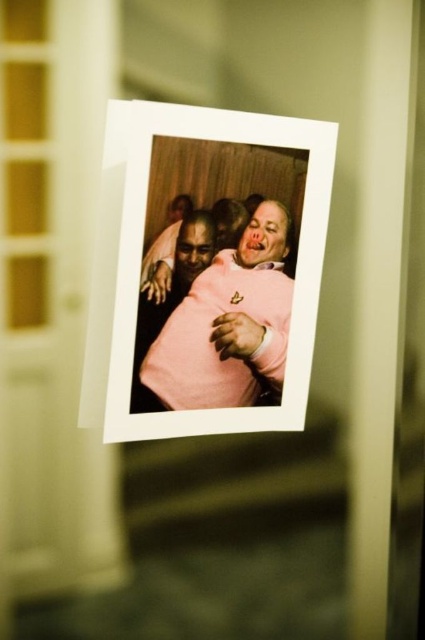
How much distance is there between white paper at center and pink matte sweater at center?

They are 1.17 inches apart.

This screenshot has width=425, height=640. I want to click on white paper at center, so click(x=206, y=269).